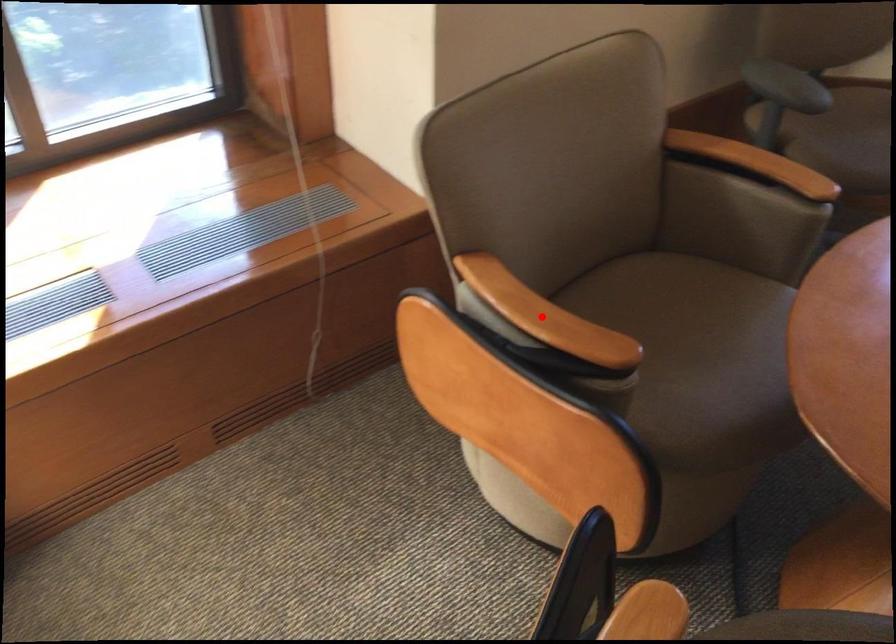
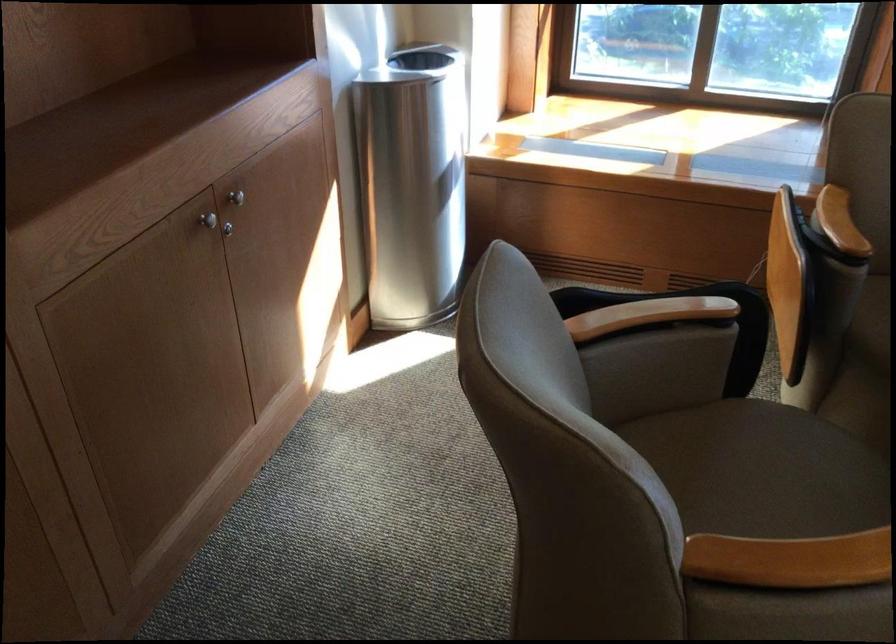
Question: I am providing you with two images of the same scene from different viewpoints. Given a red point in image1, look at the same physical point in image2. Is it:

Choices:
 (A) Closer to the viewpoint
 (B) Farther from the viewpoint

Answer: (B)